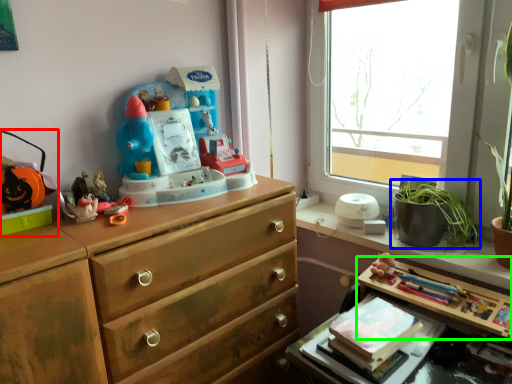
Question: Which object is positioned closest to toy (highlighted by a red box)? Select from houseplant (highlighted by a blue box) and table (highlighted by a green box).

Choices:
 (A) houseplant
 (B) table

Answer: (B)